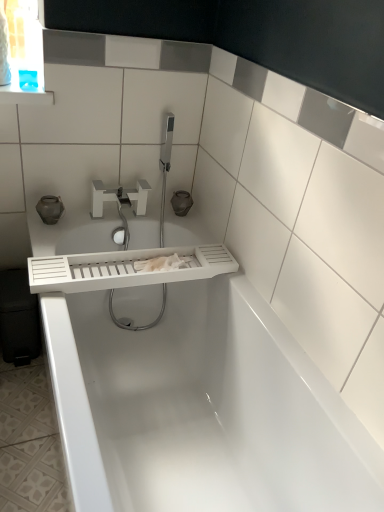
The height and width of the screenshot is (512, 384). What are the coordinates of `vacant space situated above white matte tray at center (from a real-world perspective)` in the screenshot? It's located at (142, 256).